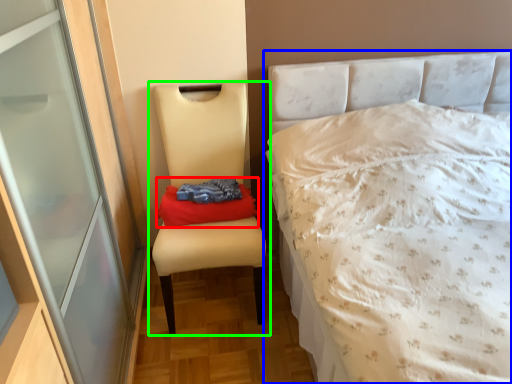
Question: Considering the real-world distances, which object is closest to material (highlighted by a red box)? bed (highlighted by a blue box) or chair (highlighted by a green box).

Choices:
 (A) bed
 (B) chair

Answer: (B)